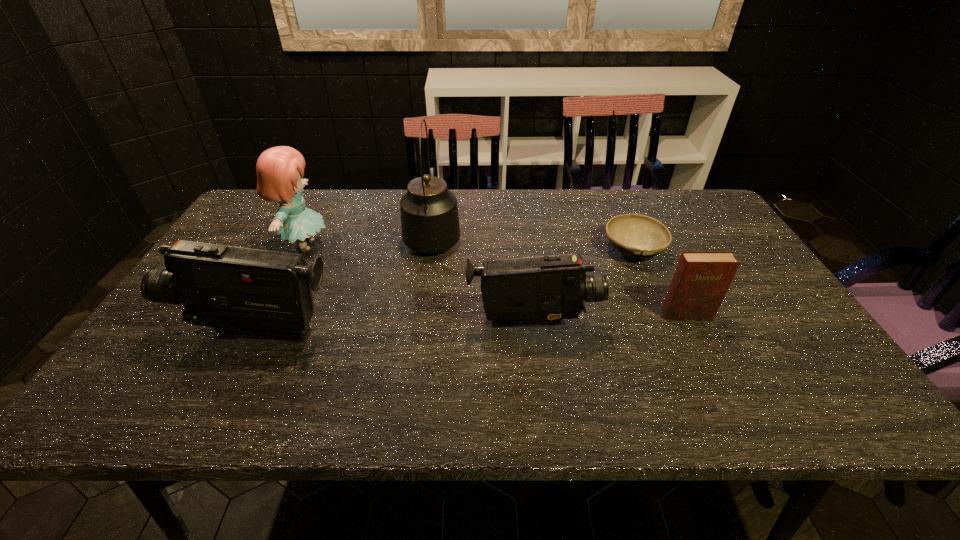
You are a GUI agent. You are given a task and a screenshot of the screen. Output one action in this format:
    pyautogui.click(x=<x>, y=<y>)
    Task: Click on the vacant space located on the front-facing side of the shorter camcorder
    The width and height of the screenshot is (960, 540).
    Given the screenshot: What is the action you would take?
    pyautogui.click(x=757, y=323)

Find the location of a particular element. vacant space located 0.160m on the front-facing side of the second tallest object is located at coordinates (386, 245).

Where is `vacant space located spout on the fourth object from right to left`? The width and height of the screenshot is (960, 540). vacant space located spout on the fourth object from right to left is located at coordinates (438, 196).

Locate an element on the screen. vacant space situated 0.160m spout on the fourth object from right to left is located at coordinates (440, 188).

This screenshot has height=540, width=960. Find the location of `blank space located 0.080m spout on the fourth object from right to left`. blank space located 0.080m spout on the fourth object from right to left is located at coordinates (438, 200).

This screenshot has width=960, height=540. I want to click on vacant region located on the front cover of the diary, so click(708, 360).

Image resolution: width=960 pixels, height=540 pixels. I want to click on vacant space positioned 0.080m on the front of the bowl, so click(x=650, y=289).

At what (x,y) coordinates should I click in order to perform the action: click on doll situated at the far edge. Please return your answer as a coordinate pair (x, y). Looking at the image, I should click on (279, 169).

This screenshot has height=540, width=960. I want to click on kettle present at the far edge, so click(430, 224).

The image size is (960, 540). In order to click on object present at the near edge in this screenshot , I will do `click(238, 291)`.